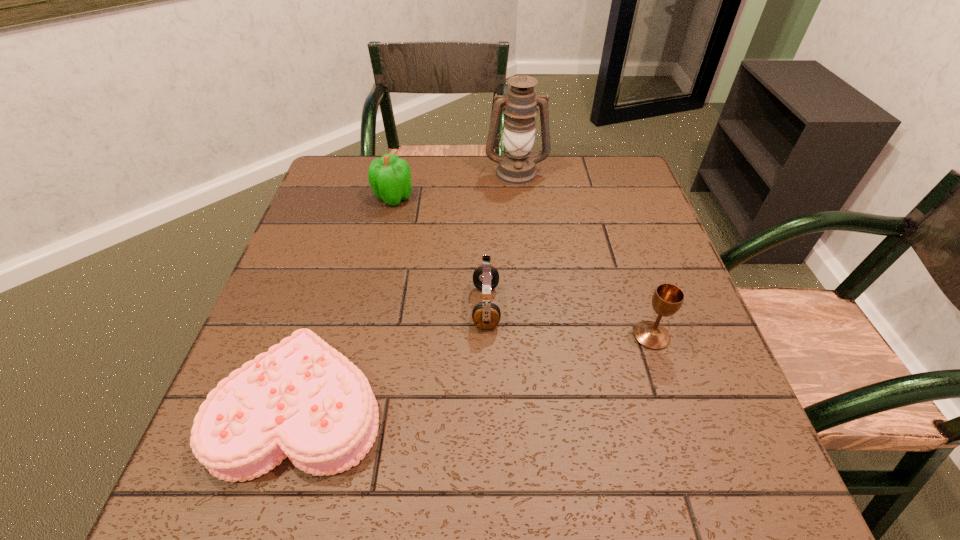
Where is `vacant point that satisfies the following two spatial constraints: 1. on the front side of the rightmost object; 2. on the right side of the bell pepper`? The width and height of the screenshot is (960, 540). vacant point that satisfies the following two spatial constraints: 1. on the front side of the rightmost object; 2. on the right side of the bell pepper is located at coordinates (362, 336).

This screenshot has width=960, height=540. What are the coordinates of `free spot that satisfies the following two spatial constraints: 1. on the front side of the chalice; 2. on the left side of the fourth nearest object` in the screenshot? It's located at (362, 336).

Locate an element on the screen. free spot that satisfies the following two spatial constraints: 1. on the ear cups of the headset; 2. on the back side of the chalice is located at coordinates (487, 336).

Where is `free space in the image that satisfies the following two spatial constraints: 1. on the ear cups of the headset; 2. on the right side of the rightmost object`? The image size is (960, 540). free space in the image that satisfies the following two spatial constraints: 1. on the ear cups of the headset; 2. on the right side of the rightmost object is located at coordinates (487, 336).